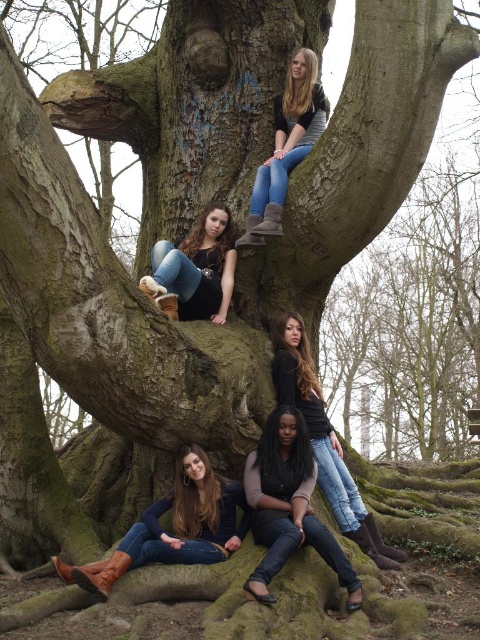
You are standing in front of the large tree in the park. There are two points marked on the tree trunk. One is at coordinate point (279,408) and the other is at point (294,397). Which point is closer to you?

Point (279,408) is closer to the viewer than point (294,397).

You are standing at the origin point in the image and want to move to the brown leather boots at lower center. What are the coordinates you need to move to?

The coordinates to move to the brown leather boots at lower center are at point (173,525).

You are standing at the base of the large, gnarled tree in the park. You see two points marked on the ground near the roots. The first point is at coordinates point (189, 540) and the second is at point (188, 273). If you want to place a small flag at the point that is closer to you, which point should you choose?

Point (189, 540) is in front of point (188, 273), so you should place the flag at point (189, 540) since it is closer to you.